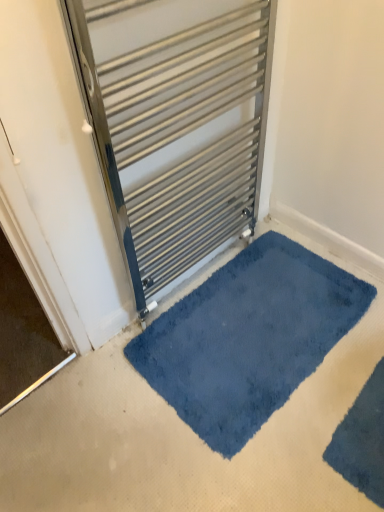
Find the location of a particular element. This screenshot has width=384, height=512. vacant area that lies between blue plush bath mat at center, which appears as the 1th bath mat when viewed from the back, and velvety blue bath mat at lower right, which is the 1th bath mat from front to back is located at coordinates (309, 421).